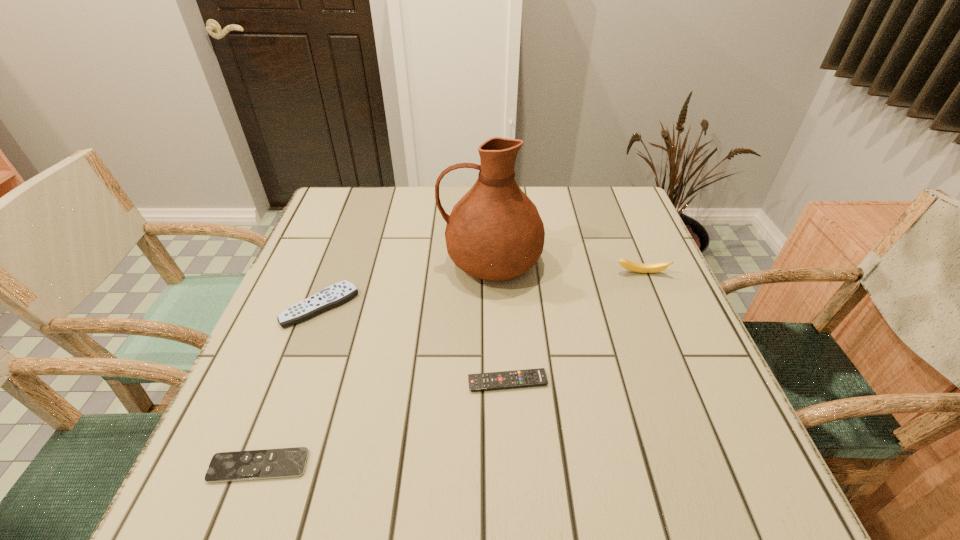
This screenshot has width=960, height=540. I want to click on vacant space that's between the tallest object and the nearest remote control, so click(374, 363).

The width and height of the screenshot is (960, 540). What are the coordinates of `vacant space that's between the tallest remote control and the shortest object` in the screenshot? It's located at (290, 386).

The width and height of the screenshot is (960, 540). Find the location of `free spot between the second shortest object and the second tallest object`. free spot between the second shortest object and the second tallest object is located at coordinates (574, 327).

This screenshot has height=540, width=960. I want to click on free space between the tallest object and the shortest remote control, so click(374, 363).

The image size is (960, 540). In order to click on vacant space that's between the second farthest remote control and the third tallest object in this screenshot , I will do `click(414, 344)`.

Identify which object is the fourth closest to the tallest object. Please provide its 2D coordinates. Your answer should be formatted as a tuple, i.e. [(x, y)], where the tuple contains the x and y coordinates of a point satisfying the conditions above.

[(285, 462)]

This screenshot has width=960, height=540. In order to click on object identified as the second closest to the tallest remote control in this screenshot , I will do `click(285, 462)`.

Identify which remote control is located as the nearest to the nearest remote control. Please provide its 2D coordinates. Your answer should be formatted as a tuple, i.e. [(x, y)], where the tuple contains the x and y coordinates of a point satisfying the conditions above.

[(338, 293)]

Select which remote control is the third closest to the rightmost object. Please provide its 2D coordinates. Your answer should be formatted as a tuple, i.e. [(x, y)], where the tuple contains the x and y coordinates of a point satisfying the conditions above.

[(285, 462)]

This screenshot has height=540, width=960. I want to click on free location that satisfies the following two spatial constraints: 1. on the side of the tallest object with the handle; 2. on the front side of the third tallest object, so click(x=492, y=307).